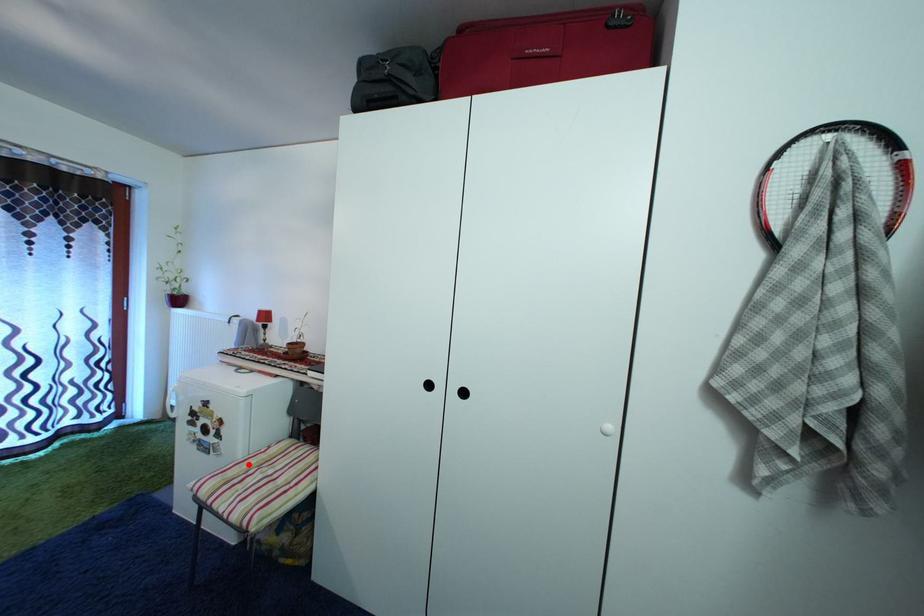
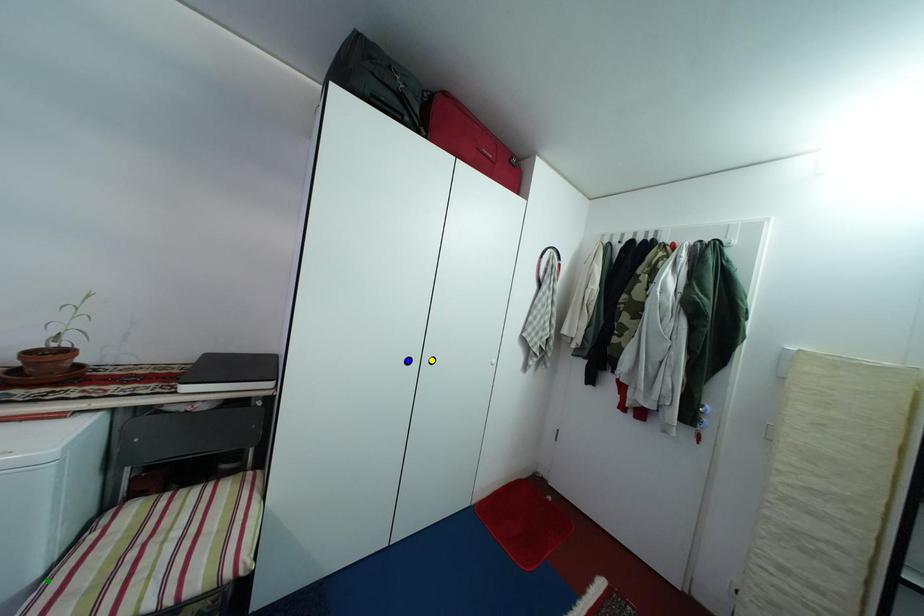
Question: I am providing you with two images of the same scene from different viewpoints. A red point is marked on the first image. You are given multiple points on the second image. Can you choose the point in image 2 that corresponds to the point in image 1?

Choices:
 (A) green point
 (B) blue point
 (C) yellow point

Answer: (A)